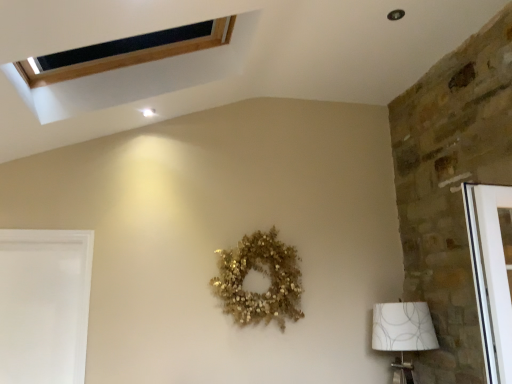
What do you see at coordinates (44, 305) in the screenshot?
I see `white matte screen door at lower left` at bounding box center [44, 305].

Where is `white matte screen door at lower left`? This screenshot has width=512, height=384. white matte screen door at lower left is located at coordinates (44, 305).

Describe the element at coordinates (403, 333) in the screenshot. I see `white fabric lampshade at lower right` at that location.

Locate an element on the screen. The image size is (512, 384). white fabric lampshade at lower right is located at coordinates (403, 333).

The width and height of the screenshot is (512, 384). I want to click on white matte screen door at lower left, so click(44, 305).

Considering the relative positions of white fabric lampshade at lower right and white matte screen door at lower left in the image provided, is white fabric lampshade at lower right to the right of white matte screen door at lower left from the viewer's perspective?

Yes, white fabric lampshade at lower right is to the right of white matte screen door at lower left.

Between white fabric lampshade at lower right and white matte screen door at lower left, which one is positioned in front?

white matte screen door at lower left is closer to the camera.

Is point (380, 341) closer or farther from the camera than point (33, 336)?

Point (380, 341) appears to be farther away from the viewer than point (33, 336).

From the image's perspective, which is above, white fabric lampshade at lower right or white matte screen door at lower left?

white matte screen door at lower left.

From a real-world perspective, is white fabric lampshade at lower right above or below white matte screen door at lower left?

From a real-world perspective, white fabric lampshade at lower right is physically below white matte screen door at lower left.

Considering the sizes of objects white fabric lampshade at lower right and white matte screen door at lower left in the image provided, who is thinner, white fabric lampshade at lower right or white matte screen door at lower left?

white matte screen door at lower left.

Considering the sizes of objects white fabric lampshade at lower right and white matte screen door at lower left in the image provided, who is shorter, white fabric lampshade at lower right or white matte screen door at lower left?

With less height is white fabric lampshade at lower right.

Can you confirm if white fabric lampshade at lower right is smaller than white matte screen door at lower left?

Actually, white fabric lampshade at lower right might be larger than white matte screen door at lower left.

Is white matte screen door at lower left located within white fabric lampshade at lower right?

No, white matte screen door at lower left is not surrounded by white fabric lampshade at lower right.

Is the surface of white fabric lampshade at lower right in direct contact with white matte screen door at lower left?

white fabric lampshade at lower right and white matte screen door at lower left are not in contact.

Is white fabric lampshade at lower right turned away from white matte screen door at lower left?

That's not correct — white fabric lampshade at lower right is not looking away from white matte screen door at lower left.

Can you tell me how much white fabric lampshade at lower right and white matte screen door at lower left differ in facing direction?

The facing directions of white fabric lampshade at lower right and white matte screen door at lower left are 0.00269 degrees apart.

Where is `screen door that is on the left side of white fabric lampshade at lower right`? screen door that is on the left side of white fabric lampshade at lower right is located at coordinates (44, 305).

Would you say white matte screen door at lower left is to the left or to the right of white fabric lampshade at lower right in the picture?

white matte screen door at lower left is positioned on white fabric lampshade at lower right's left side.

Is white matte screen door at lower left in front of or behind white fabric lampshade at lower right in the image?

white matte screen door at lower left is in front of white fabric lampshade at lower right.

Which is in front, point (16, 305) or point (402, 328)?

The point (402, 328) is closer to the camera.

From the image's perspective, between white matte screen door at lower left and white fabric lampshade at lower right, who is located below?

white fabric lampshade at lower right is shown below in the image.

From a real-world perspective, between white matte screen door at lower left and white fabric lampshade at lower right, who is vertically higher?

white matte screen door at lower left is physically above.

Is white matte screen door at lower left thinner than white fabric lampshade at lower right?

Yes, white matte screen door at lower left is thinner than white fabric lampshade at lower right.

Can you confirm if white matte screen door at lower left is taller than white fabric lampshade at lower right?

Correct, white matte screen door at lower left is much taller as white fabric lampshade at lower right.

Can you confirm if white matte screen door at lower left is smaller than white fabric lampshade at lower right?

Yes.

Could white fabric lampshade at lower right be considered to be inside white matte screen door at lower left?

That's incorrect, white fabric lampshade at lower right is not inside white matte screen door at lower left.

Is there a large distance between white matte screen door at lower left and white fabric lampshade at lower right?

That's right, there is a large distance between white matte screen door at lower left and white fabric lampshade at lower right.

Does white matte screen door at lower left turn towards white fabric lampshade at lower right?

No, white matte screen door at lower left does not turn towards white fabric lampshade at lower right.

Measure the distance from white matte screen door at lower left to white fabric lampshade at lower right.

white matte screen door at lower left is 7.39 feet from white fabric lampshade at lower right.

The image size is (512, 384). Identify the location of lamp below the white matte screen door at lower left (from a real-world perspective). (403, 333).

Where is `screen door above the white fabric lampshade at lower right (from a real-world perspective)`? This screenshot has height=384, width=512. screen door above the white fabric lampshade at lower right (from a real-world perspective) is located at coordinates (44, 305).

Where is `lamp below the white matte screen door at lower left (from the image's perspective)`? The image size is (512, 384). lamp below the white matte screen door at lower left (from the image's perspective) is located at coordinates pos(403,333).